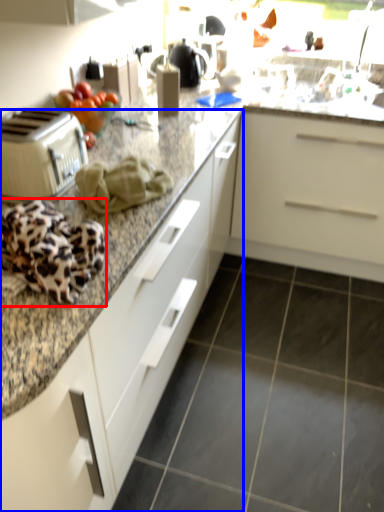
Question: Among these objects, which one is nearest to the camera, blanket (highlighted by a red box) or cabinetry (highlighted by a blue box)?

Choices:
 (A) blanket
 (B) cabinetry

Answer: (B)